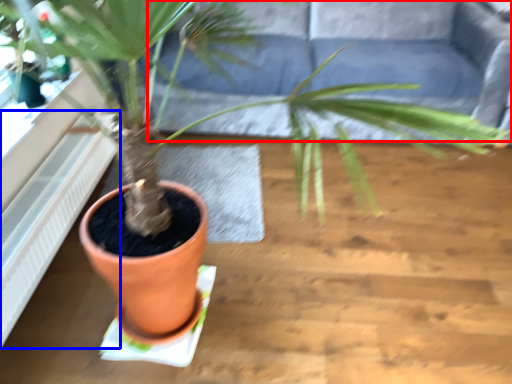
Question: Among these objects, which one is farthest to the camera, couch (highlighted by a red box) or radiator (highlighted by a blue box)?

Choices:
 (A) couch
 (B) radiator

Answer: (A)